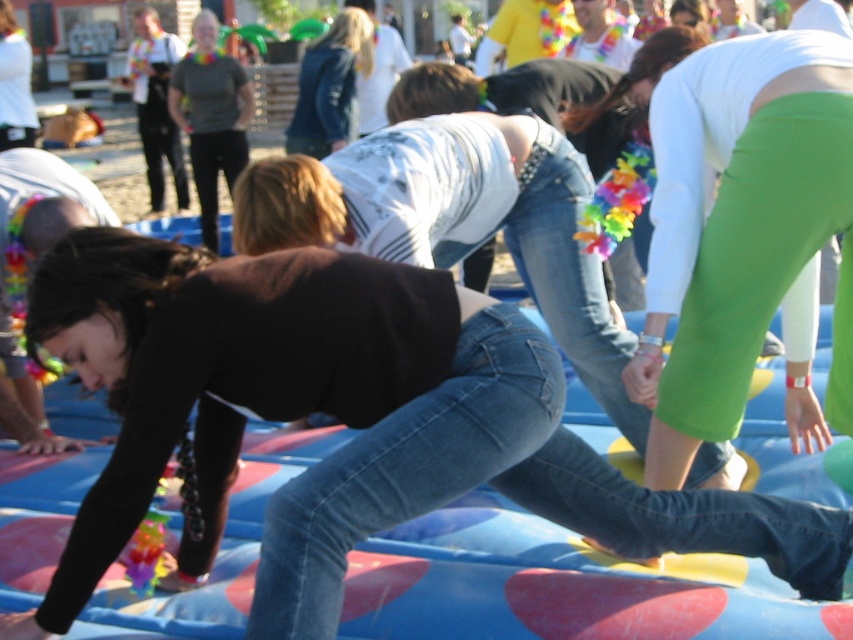
Question: Which of the following is the closest to the observer?

Choices:
 (A) (368, 64)
 (B) (798, 541)
 (C) (793, 211)

Answer: (B)

Question: Can you confirm if green spandex pants at center is positioned above jeans at center?

Choices:
 (A) yes
 (B) no

Answer: (A)

Question: Which is farther from the denim jacket at center?

Choices:
 (A) jeans at center
 (B) green spandex pants at center

Answer: (A)

Question: Does green spandex pants at center come behind denim jacket at center?

Choices:
 (A) yes
 (B) no

Answer: (B)

Question: Which of these objects is positioned closest to the jeans at center?

Choices:
 (A) green spandex pants at center
 (B) denim jacket at center

Answer: (A)

Question: Is green spandex pants at center wider than denim jacket at center?

Choices:
 (A) yes
 (B) no

Answer: (B)